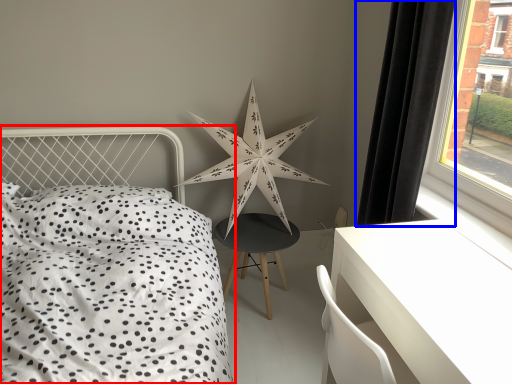
Question: Which of the following is the farthest to the observer, bed (highlighted by a red box) or curtain (highlighted by a blue box)?

Choices:
 (A) bed
 (B) curtain

Answer: (B)